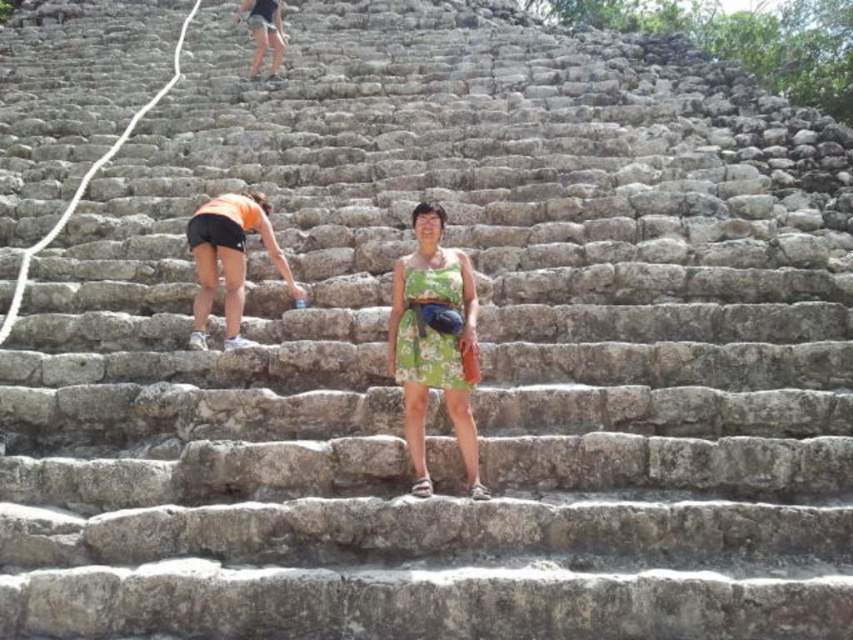
Question: Which point is closer to the camera taking this photo?

Choices:
 (A) (221, 237)
 (B) (421, 300)

Answer: (B)

Question: Can you confirm if green floral dress at center is bigger than orange fabric shorts at upper left?

Choices:
 (A) yes
 (B) no

Answer: (B)

Question: Is green floral dress at center below orange fabric shorts at upper left?

Choices:
 (A) yes
 (B) no

Answer: (A)

Question: Can you confirm if green floral dress at center is thinner than orange fabric shorts at upper left?

Choices:
 (A) no
 (B) yes

Answer: (B)

Question: Which of the following is the closest to the observer?

Choices:
 (A) (465, 388)
 (B) (196, 342)

Answer: (A)

Question: Which point appears farthest from the camera in this image?

Choices:
 (A) (229, 340)
 (B) (445, 390)

Answer: (A)